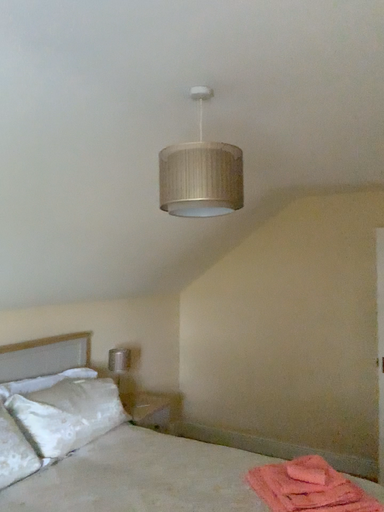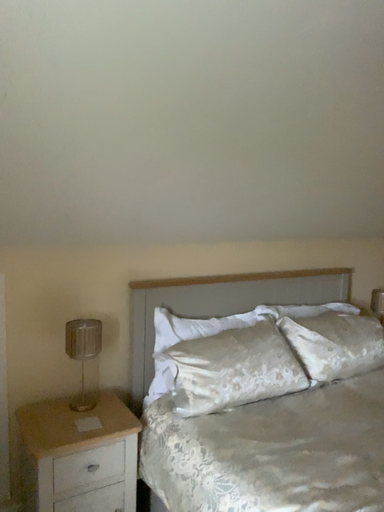
Question: How did the camera likely rotate when shooting the video?

Choices:
 (A) rotated downward
 (B) rotated upward

Answer: (A)